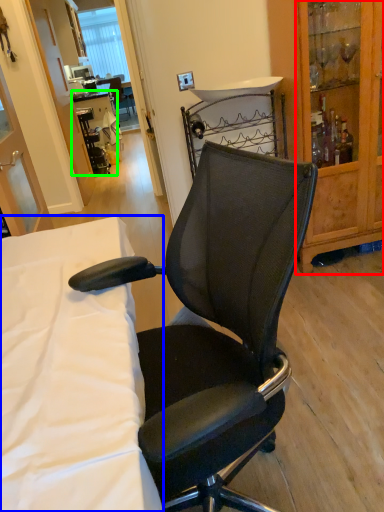
Question: Considering the real-world distances, which object is farthest from cabinetry (highlighted by a red box)? desk (highlighted by a blue box) or table (highlighted by a green box)?

Choices:
 (A) desk
 (B) table

Answer: (B)